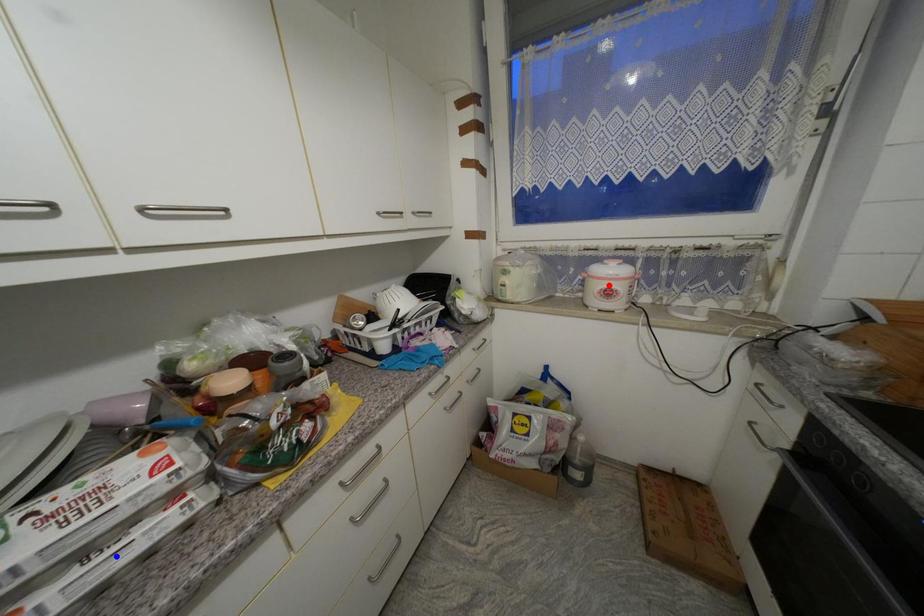
Question: Which of the two points in the image is closer to the camera?

Choices:
 (A) Blue point is closer.
 (B) Red point is closer.

Answer: (A)